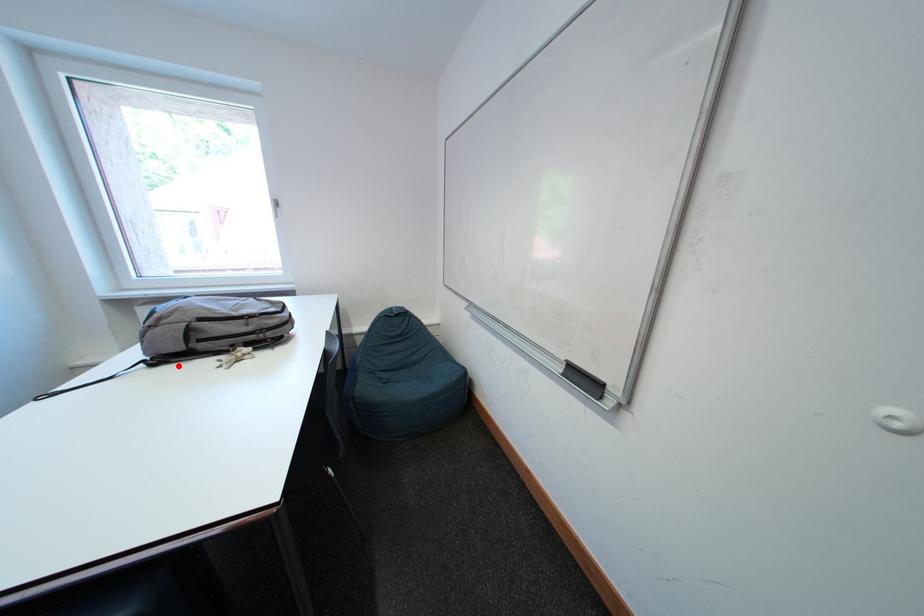
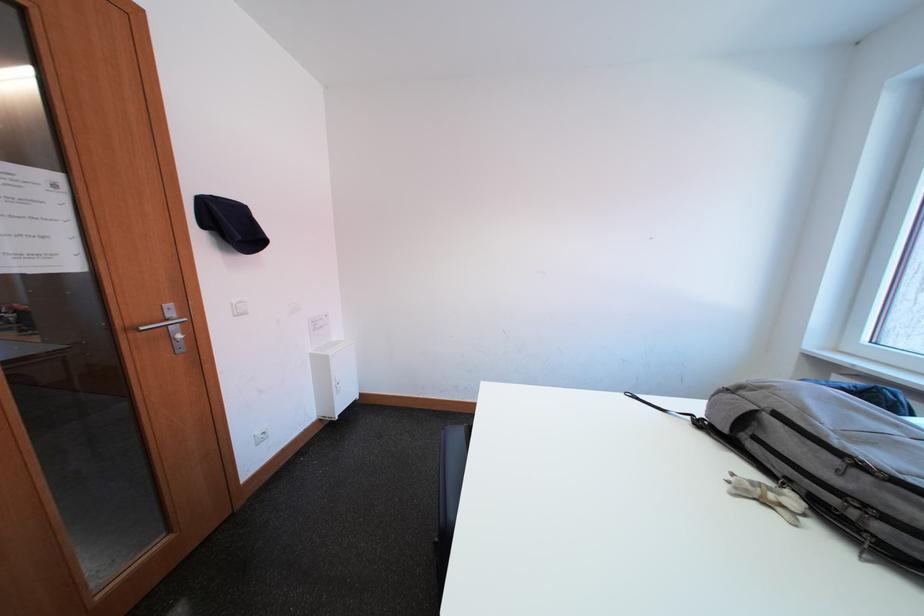
In the second image, find the point that corresponds to the highlighted location in the first image.

(719, 438)